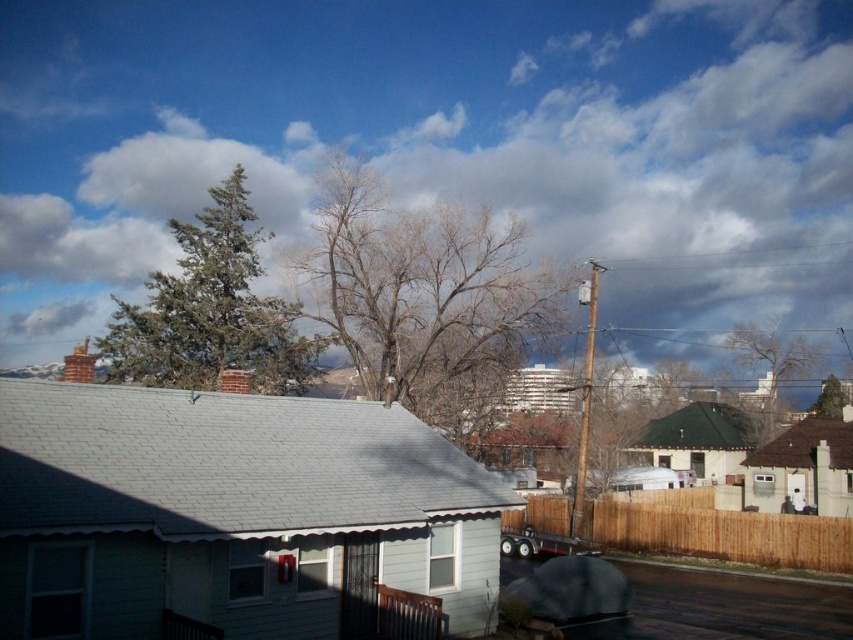
Looking at the suburban scene, you notice the white fluffy cloud at upper center and the bare branches at upper right. Which object takes up more space in the sky?

The white fluffy cloud at upper center is bigger than the bare branches at upper right, so it takes up more space in the sky.